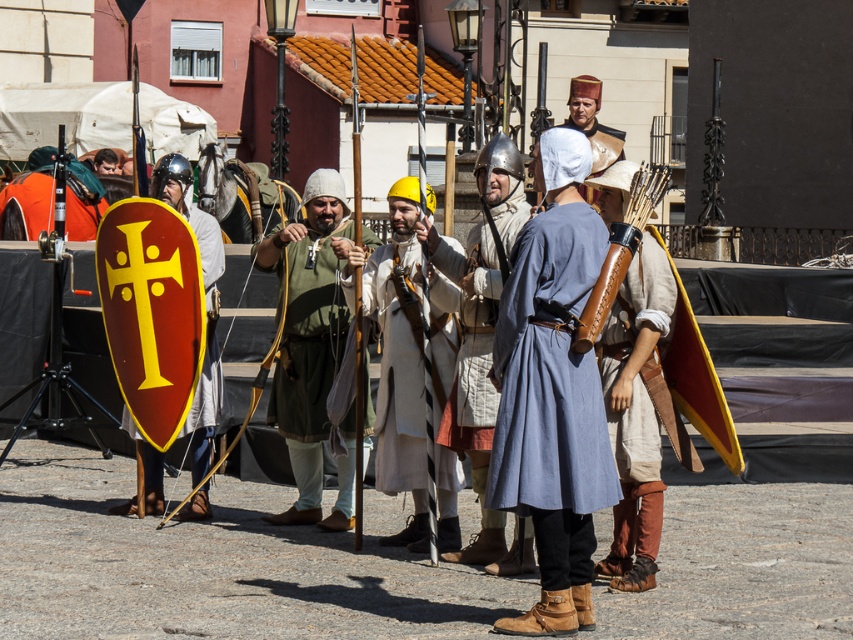
You are a medieval scribe observing the scene and need to record the order of the clothing layers. Which clothing item is visible on top between the blue linen tunic at center and the white woolen coat at center?

The blue linen tunic at center is in front of the white woolen coat at center, so the blue linen tunic at center is visible on top.

You are a knight in the medieval scene. You notice the matte silver helmet at center and the white woolen coat at center. Which item is positioned higher relative to your viewpoint?

The matte silver helmet at center is located above the white woolen coat at center, so it is positioned higher.

You are a costume designer inspecting the medieval costumes in the image. You notice the blue linen tunic at center and the white woolen coat at center. Which garment is visible on top?

The blue linen tunic at center is positioned over the white woolen coat at center, so the blue linen tunic at center is visible on top.